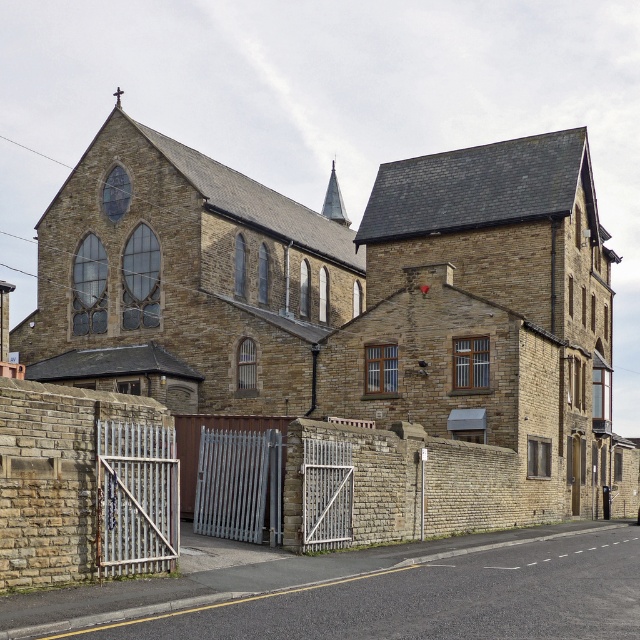
Question: Which of the following is the farthest from the observer?

Choices:
 (A) click(339, 189)
 (B) click(296, 204)

Answer: (A)

Question: Is brown stone church at center behind smooth gray spire at upper center?

Choices:
 (A) no
 (B) yes

Answer: (A)

Question: From the image, what is the correct spatial relationship of brown stone church at center in relation to smooth gray spire at upper center?

Choices:
 (A) right
 (B) left

Answer: (A)

Question: Which object appears closest to the camera in this image?

Choices:
 (A) brown stone church at center
 (B) smooth gray spire at upper center

Answer: (A)

Question: Does brown stone church at center have a smaller size compared to smooth gray spire at upper center?

Choices:
 (A) no
 (B) yes

Answer: (A)